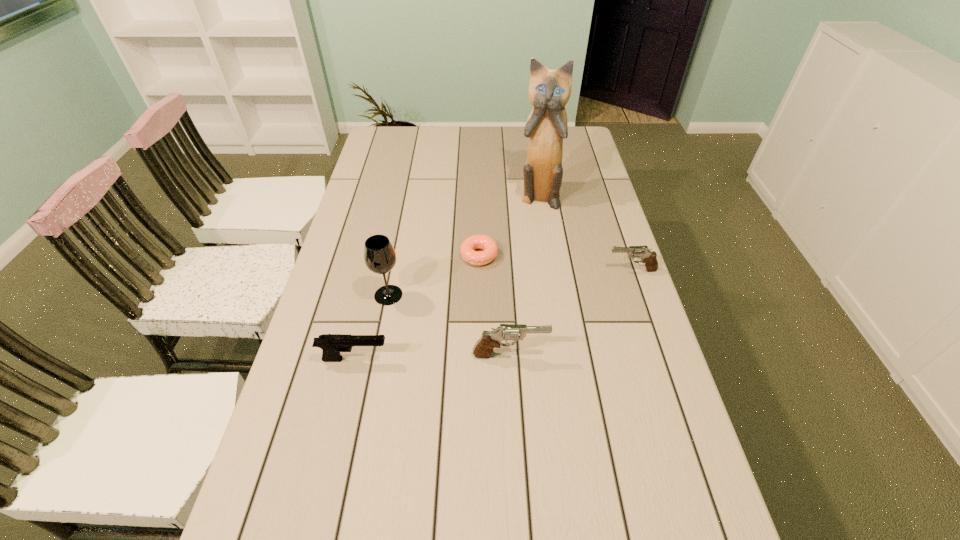
Identify the location of blank space that satisfies the following two spatial constraints: 1. on the face of the tallest object; 2. at the barrel of the tallest pistol. This screenshot has height=540, width=960. (563, 355).

What are the coordinates of `vacant area in the image that satisfies the following two spatial constraints: 1. on the face of the cat; 2. on the front-facing side of the leftmost pistol` in the screenshot? It's located at (564, 359).